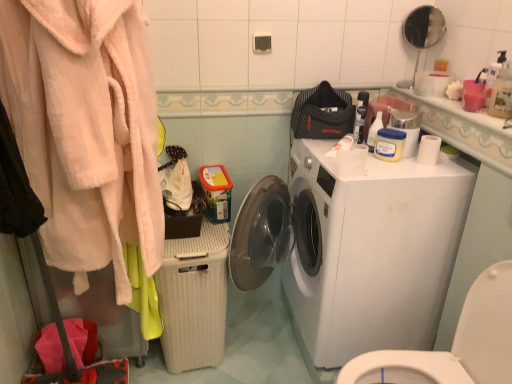
Where is `unoccupied region to the right of white matte toilet paper at upper right`? unoccupied region to the right of white matte toilet paper at upper right is located at coordinates (457, 161).